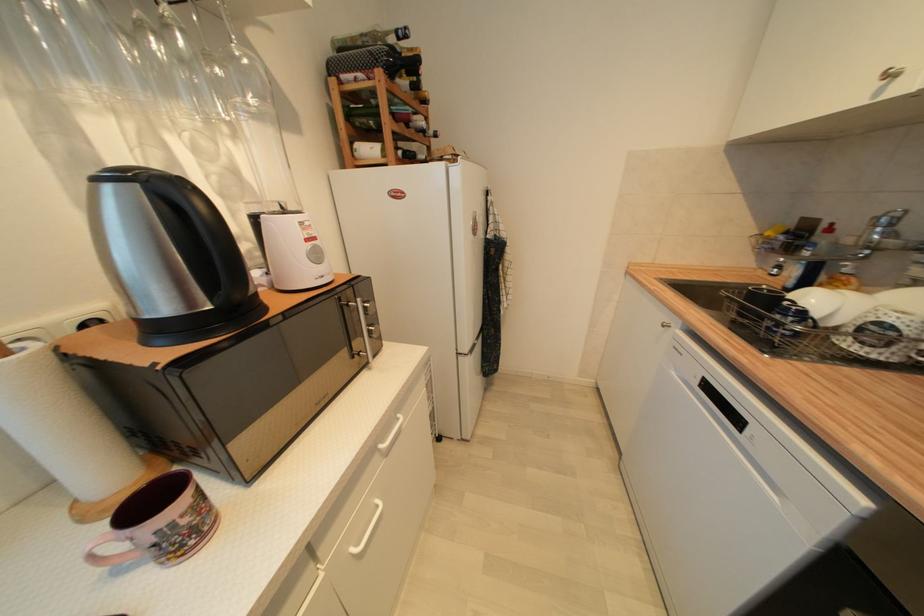
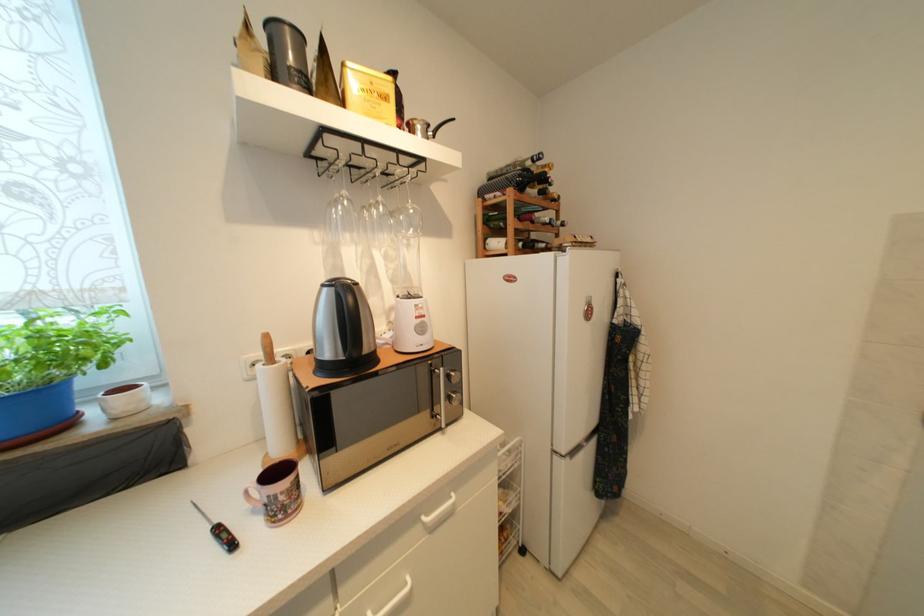
Question: I am providing you with two images of the same scene from different viewpoints. After the viewpoint changes to image2, which objects are now occluded?

Choices:
 (A) white ceramic pot
 (B) gold tea tin
 (C) digital thermometer
 (D) none of these

Answer: (D)